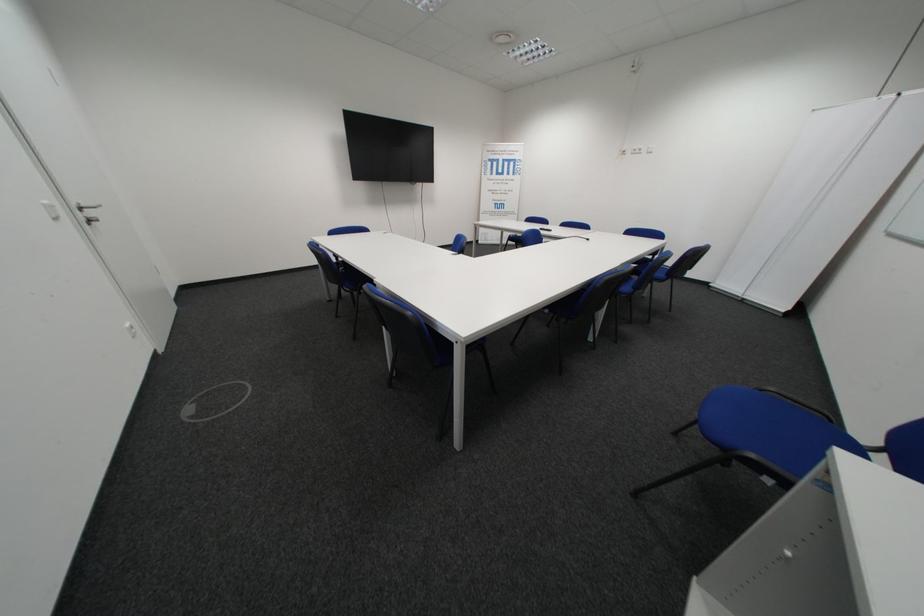
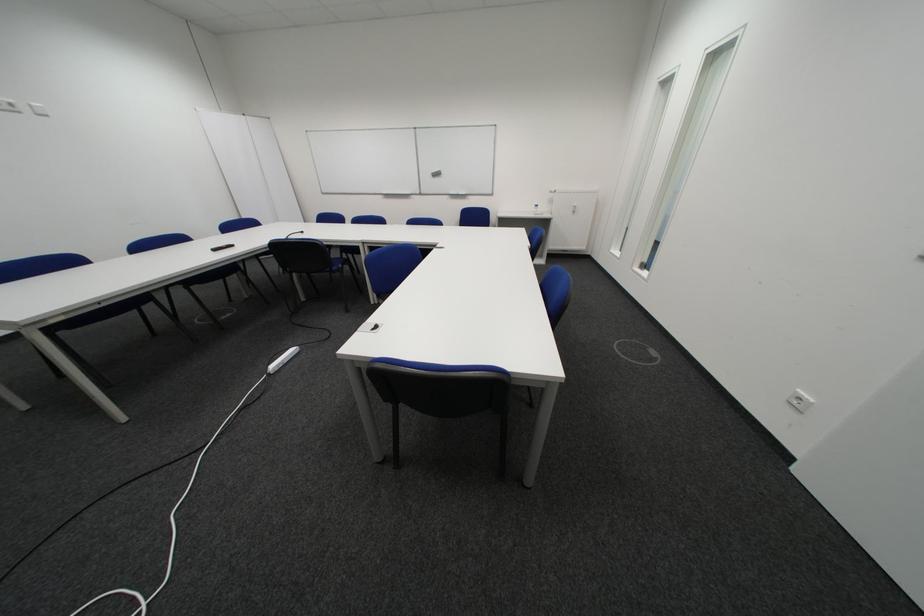
Find the pixel in the second image that matches (x=646, y=153) in the first image.

(8, 108)